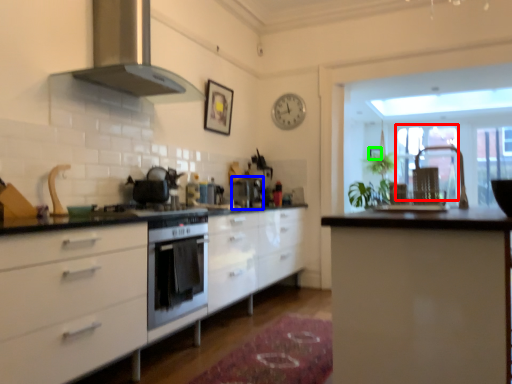
Question: Which object is the closest to the glass door (highlighted by a red box)? Choose among these: coffee machine (highlighted by a blue box) or picture frame (highlighted by a green box).

Choices:
 (A) coffee machine
 (B) picture frame

Answer: (B)